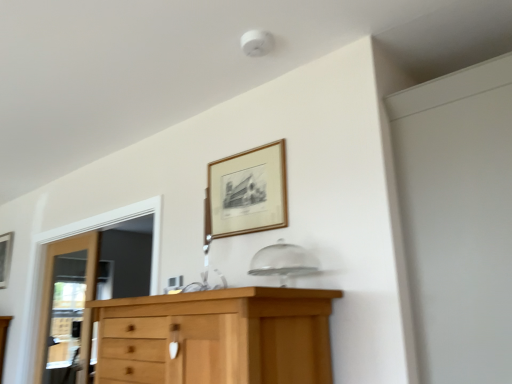
The image size is (512, 384). What do you see at coordinates (458, 219) in the screenshot?
I see `white matte screen door at upper right` at bounding box center [458, 219].

The height and width of the screenshot is (384, 512). I want to click on wooden picture frame at upper center, which is the 1th picture frame in front-to-back order, so click(x=247, y=192).

Is wooden picture frame at left, placed as the second picture frame when sorted from right to left, not within wooden door at left?

That's correct, wooden picture frame at left, placed as the second picture frame when sorted from right to left, is outside of wooden door at left.

Looking at the image, does wooden picture frame at left, which appears as the 1th picture frame when viewed from the left, seem bigger or smaller compared to wooden door at left?

wooden picture frame at left, which appears as the 1th picture frame when viewed from the left, is smaller than wooden door at left.

Considering the sizes of objects wooden picture frame at left, which appears as the 1th picture frame when viewed from the left, and wooden door at left in the image provided, who is wider, wooden picture frame at left, which appears as the 1th picture frame when viewed from the left, or wooden door at left?

Wider between the two is wooden door at left.

From the image's perspective, does wooden picture frame at left, placed as the second picture frame when sorted from right to left, appear lower than wooden door at left?

Incorrect, from the image's perspective, wooden picture frame at left, placed as the second picture frame when sorted from right to left, is higher than wooden door at left.

Is wooden door at left with wooden picture frame at upper center, acting as the 2th picture frame starting from the bottom?

No, wooden door at left is not making contact with wooden picture frame at upper center, acting as the 2th picture frame starting from the bottom.

Can you confirm if wooden door at left is shorter than wooden picture frame at upper center, acting as the 2th picture frame starting from the back?

In fact, wooden door at left may be taller than wooden picture frame at upper center, acting as the 2th picture frame starting from the back.

Is point (87, 273) farther from camera compared to point (233, 191)?

Yes, it is.

Between point (269, 200) and point (7, 245), which one is positioned in front?

The point (269, 200) is closer.

Is wooden picture frame at upper center, the 1th picture frame positioned from the right, closer to the viewer compared to wooden picture frame at left, placed as the second picture frame when sorted from right to left?

That is True.

The image size is (512, 384). I want to click on picture frame located above the wooden picture frame at left, positioned as the 2th picture frame in top-to-bottom order (from a real-world perspective), so coord(247,192).

Based on the photo, is wooden picture frame at upper center, which is the 1th picture frame in front-to-back order, at the left side of wooden picture frame at left, which appears as the 1th picture frame when viewed from the left?

In fact, wooden picture frame at upper center, which is the 1th picture frame in front-to-back order, is to the right of wooden picture frame at left, which appears as the 1th picture frame when viewed from the left.

Is wooden picture frame at upper center, the 1th picture frame positioned from the right, at the left side of white matte screen door at upper right?

Correct, you'll find wooden picture frame at upper center, the 1th picture frame positioned from the right, to the left of white matte screen door at upper right.

Is wooden picture frame at upper center, which is the 1th picture frame in front-to-back order, facing away from white matte screen door at upper right?

wooden picture frame at upper center, which is the 1th picture frame in front-to-back order, is not turned away from white matte screen door at upper right.

Measure the distance from wooden picture frame at upper center, acting as the 2th picture frame starting from the bottom, to white matte screen door at upper right.

wooden picture frame at upper center, acting as the 2th picture frame starting from the bottom, is 76.25 centimeters away from white matte screen door at upper right.

Between point (398, 195) and point (3, 240), which one is positioned behind?

Positioned behind is point (3, 240).

How different are the orientations of white matte screen door at upper right and wooden picture frame at left, which is the first picture frame in bottom-to-top order, in degrees?

The angular difference between white matte screen door at upper right and wooden picture frame at left, which is the first picture frame in bottom-to-top order, is 90.6 degrees.

Is white matte screen door at upper right located outside wooden picture frame at left, which is the first picture frame in bottom-to-top order?

white matte screen door at upper right lies outside wooden picture frame at left, which is the first picture frame in bottom-to-top order,'s area.

Based on the photo, choose the correct answer: Is white matte screen door at upper right inside wooden door at left or outside it?

white matte screen door at upper right exists outside the volume of wooden door at left.

How different are the orientations of white matte screen door at upper right and wooden door at left in degrees?

90.4 degrees separate the facing orientations of white matte screen door at upper right and wooden door at left.

Between white matte screen door at upper right and wooden door at left, which one is positioned in front?

white matte screen door at upper right.

From the image's perspective, is wooden door at left below wooden picture frame at left, which appears as the 1th picture frame when viewed from the left?

Correct, wooden door at left appears lower than wooden picture frame at left, which appears as the 1th picture frame when viewed from the left, in the image.

Consider the image. Is wooden picture frame at left, positioned as the 2th picture frame in top-to-bottom order, at the back of wooden door at left?

wooden door at left is not turned away from wooden picture frame at left, positioned as the 2th picture frame in top-to-bottom order.

Is wooden door at left spatially inside wooden picture frame at left, which appears as the 1th picture frame when viewed from the left, or outside of it?

wooden door at left is not enclosed by wooden picture frame at left, which appears as the 1th picture frame when viewed from the left.

Where is `door that appears in front of the wooden picture frame at left, which is the first picture frame in bottom-to-top order`? Image resolution: width=512 pixels, height=384 pixels. door that appears in front of the wooden picture frame at left, which is the first picture frame in bottom-to-top order is located at coordinates (67, 310).

Where is `door located underneath the wooden picture frame at upper center, the 1th picture frame positioned from the right (from a real-world perspective)`? This screenshot has height=384, width=512. door located underneath the wooden picture frame at upper center, the 1th picture frame positioned from the right (from a real-world perspective) is located at coordinates (67, 310).

Based on their spatial positions, is wooden door at left or wooden picture frame at left, which appears as the second picture frame when viewed from the front, closer to wooden picture frame at upper center, acting as the 2th picture frame starting from the left?

The object closer to wooden picture frame at upper center, acting as the 2th picture frame starting from the left, is wooden door at left.

Which object lies nearer to the anchor point wooden door at left, wooden picture frame at left, which appears as the 1th picture frame when viewed from the left, or white matte screen door at upper right?

wooden picture frame at left, which appears as the 1th picture frame when viewed from the left, is closer to wooden door at left.

When comparing their distances from white matte screen door at upper right, does wooden picture frame at upper center, the 1th picture frame positioned from the right, or wooden picture frame at left, which is the first picture frame in bottom-to-top order, seem closer?

wooden picture frame at upper center, the 1th picture frame positioned from the right.

In the scene shown: Looking at the image, which one is located further to wooden picture frame at left, positioned as the 2th picture frame in top-to-bottom order, wooden picture frame at upper center, the 1th picture frame positioned from the right, or white matte screen door at upper right?

Based on the image, white matte screen door at upper right appears to be further to wooden picture frame at left, positioned as the 2th picture frame in top-to-bottom order.

Based on the photo, which object lies nearer to the anchor point wooden picture frame at left, which ranks as the first picture frame in back-to-front order, wooden door at left or wooden picture frame at upper center, the 1th picture frame from the top?

wooden door at left.

When comparing their distances from wooden picture frame at left, which ranks as the first picture frame in back-to-front order, does wooden door at left or white matte screen door at upper right seem closer?

wooden door at left is closer to wooden picture frame at left, which ranks as the first picture frame in back-to-front order.

Looking at the image, which one is located closer to white matte screen door at upper right, wooden picture frame at upper center, the 1th picture frame from the top, or wooden door at left?

The object closer to white matte screen door at upper right is wooden picture frame at upper center, the 1th picture frame from the top.

From the image, which object appears to be nearer to white matte screen door at upper right, wooden door at left or wooden picture frame at left, positioned as the 2th picture frame in top-to-bottom order?

wooden door at left.

Image resolution: width=512 pixels, height=384 pixels. Identify the location of picture frame situated between wooden picture frame at left, placed as the second picture frame when sorted from right to left, and white matte screen door at upper right from left to right. (247, 192).

The width and height of the screenshot is (512, 384). Find the location of `picture frame between wooden door at left and white matte screen door at upper right in the horizontal direction`. picture frame between wooden door at left and white matte screen door at upper right in the horizontal direction is located at coordinates (247, 192).

The width and height of the screenshot is (512, 384). Identify the location of door situated between wooden picture frame at left, positioned as the 2th picture frame in top-to-bottom order, and white matte screen door at upper right from left to right. (67, 310).

The height and width of the screenshot is (384, 512). Identify the location of door between wooden picture frame at left, positioned as the 2th picture frame in top-to-bottom order, and wooden picture frame at upper center, acting as the 2th picture frame starting from the left, from left to right. (67, 310).